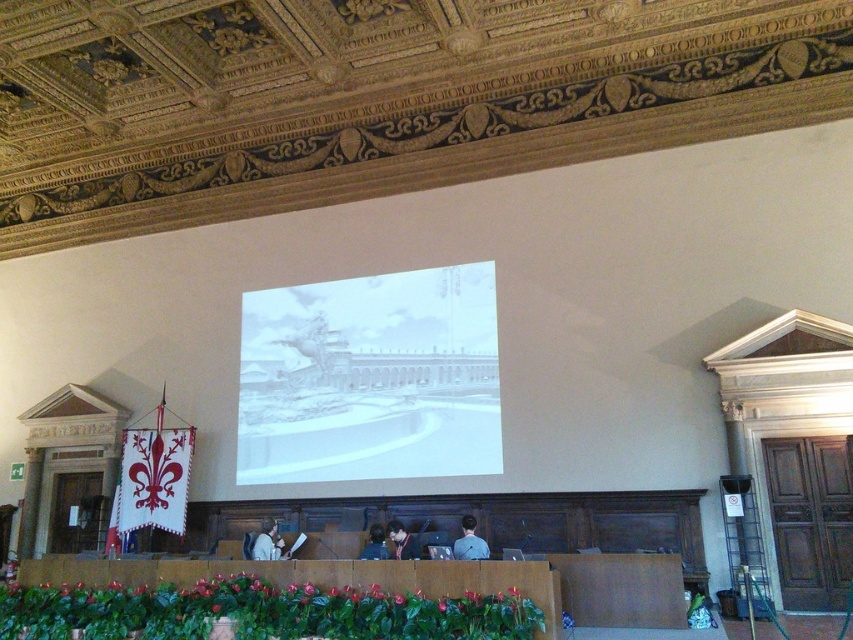
You are an attendee at a presentation and need to take notes. You see a white paper at center and a gray fabric shirt at center. Which object can you use to write on?

The white paper at center can be used to write on since it has a larger size compared to the gray fabric shirt at center, making it more suitable for taking notes.

You are organizing a presentation in this lecture hall and need to place both the white paper at center and the light brown leather jacket at lower center on a table. Which object should you place first if you want to ensure there is enough space for both?

You should place the white paper at center first because its width is larger than the light brown leather jacket at lower center, so positioning it first ensures there is sufficient space for both items.

You are organizing a presentation in this lecture hall and need to place a decorative item on the desk. The desk has limited space. If you have both the white paper at center and the light brown leather jacket at lower center, which item should you move to make more space for the new decoration?

You should move the light brown leather jacket at lower center because the white paper at center is already positioned to the right of it, indicating it is closer to the edge of the desk and might have more space available. Moving the jacket could free up space near the center.